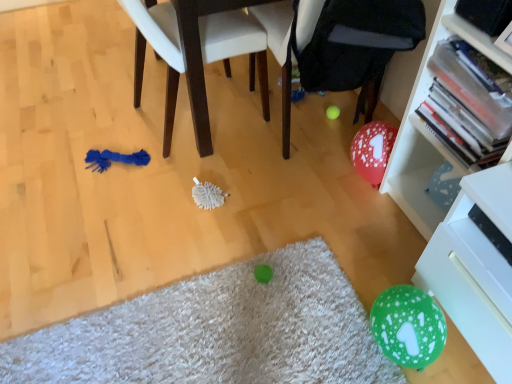
Locate an element on the screen. The image size is (512, 384). vacant space that's between black fabric bean bag chair at center and green fuzzy mat at lower center is located at coordinates (230, 226).